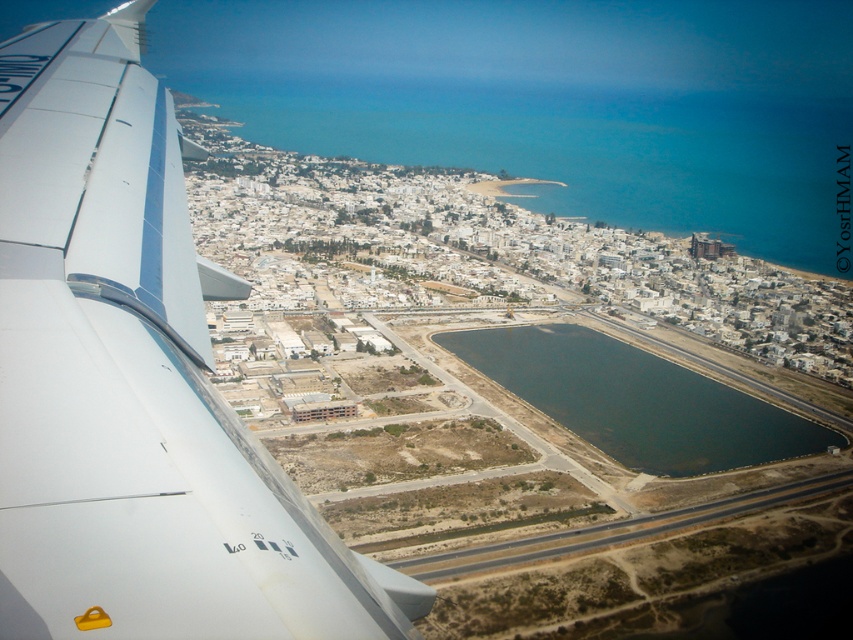
Does white matte airplane wing at upper left appear on the left side of dark blue water at center?

Correct, you'll find white matte airplane wing at upper left to the left of dark blue water at center.

Who is more distant from viewer, [45,372] or [660,394]?

The point [660,394] is behind.

The width and height of the screenshot is (853, 640). What are the coordinates of `white matte airplane wing at upper left` in the screenshot? It's located at (136, 384).